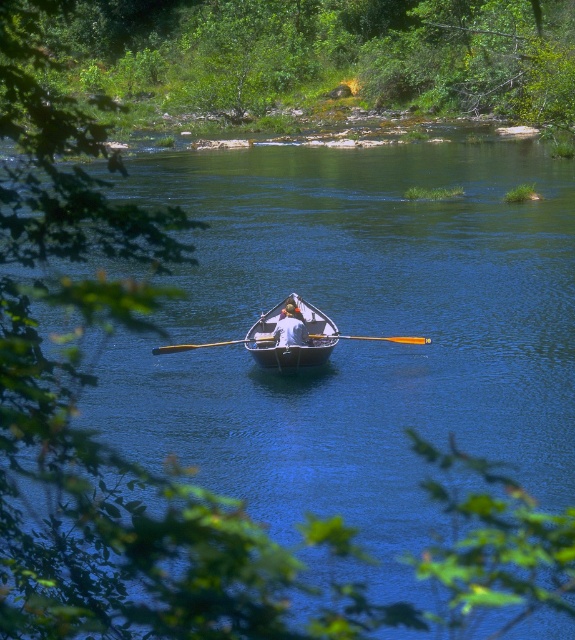
Can you confirm if white fabric boat at center is positioned to the left of wooden paddle at center?

Indeed, white fabric boat at center is positioned on the left side of wooden paddle at center.

This screenshot has width=575, height=640. Describe the element at coordinates (289, 328) in the screenshot. I see `white fabric boat at center` at that location.

Where is `white fabric boat at center`? The image size is (575, 640). white fabric boat at center is located at coordinates (289, 328).

Does yellow wood paddle at center appear on the left side of white fabric boat at center?

No, yellow wood paddle at center is not to the left of white fabric boat at center.

Which is behind, point (356, 339) or point (271, 333)?

The point (356, 339) is more distant.

Looking at this image, measure the distance between yellow wood paddle at center and camera.

The distance of yellow wood paddle at center from camera is 90.28 feet.

Where is `yellow wood paddle at center`? This screenshot has width=575, height=640. yellow wood paddle at center is located at coordinates (377, 339).

Which of these two, wooden rowboat at center or yellow wood paddle at center, stands taller?

wooden rowboat at center

Does wooden rowboat at center have a larger size compared to yellow wood paddle at center?

Yes.

Between point (310, 346) and point (227, 340), which one is positioned in front?

Point (310, 346)

Locate an element on the screen. This screenshot has width=575, height=640. wooden rowboat at center is located at coordinates (293, 339).